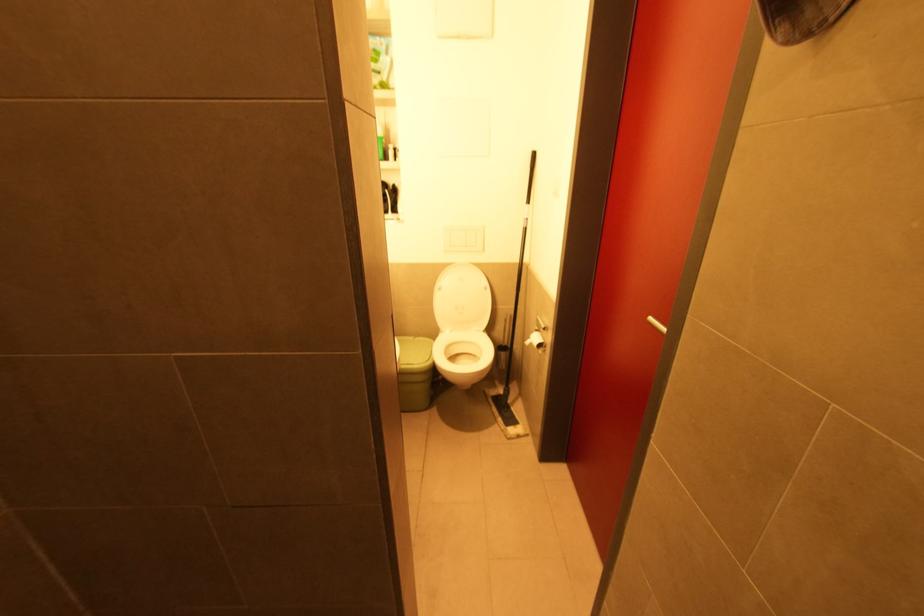
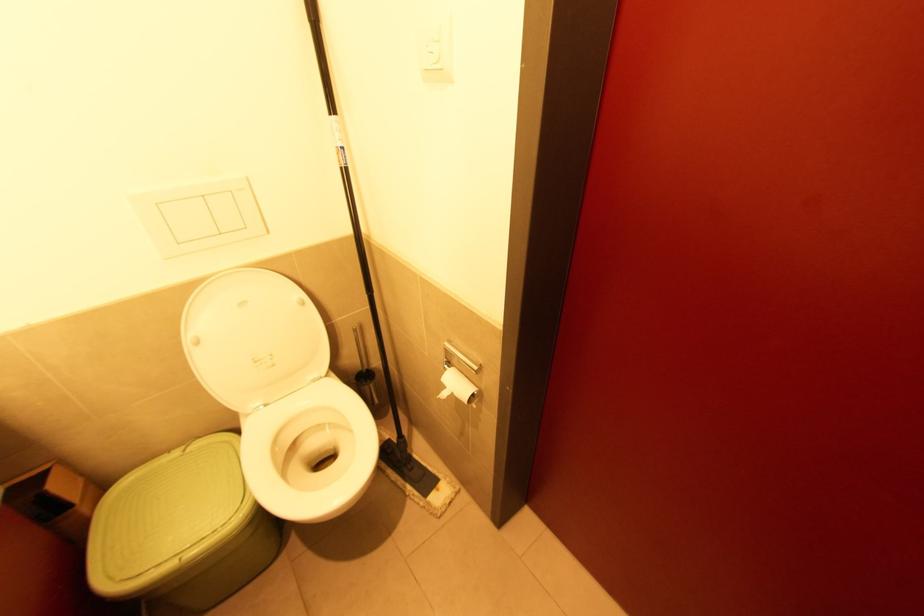
In the second image, find the point that corresponds to point 484,333 in the first image.

(329, 377)